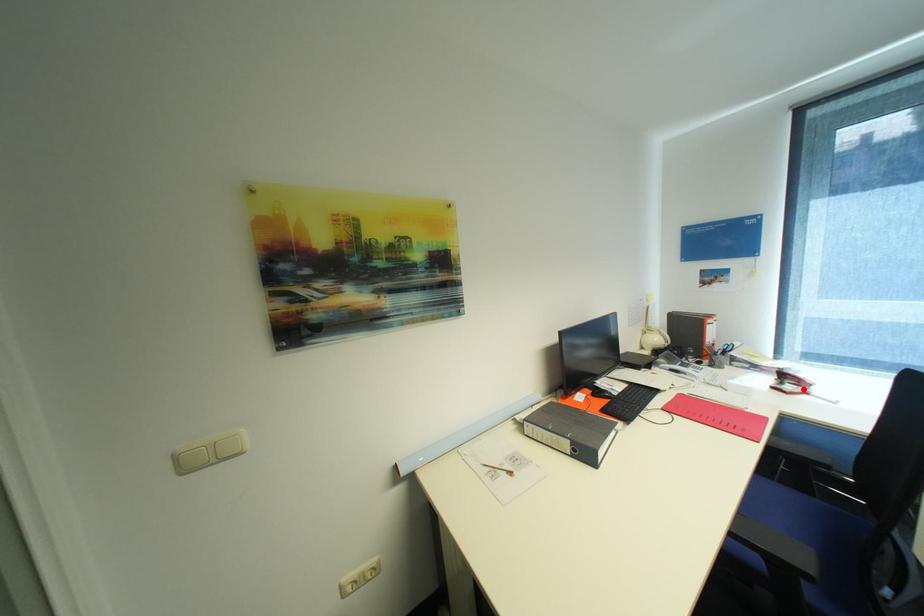
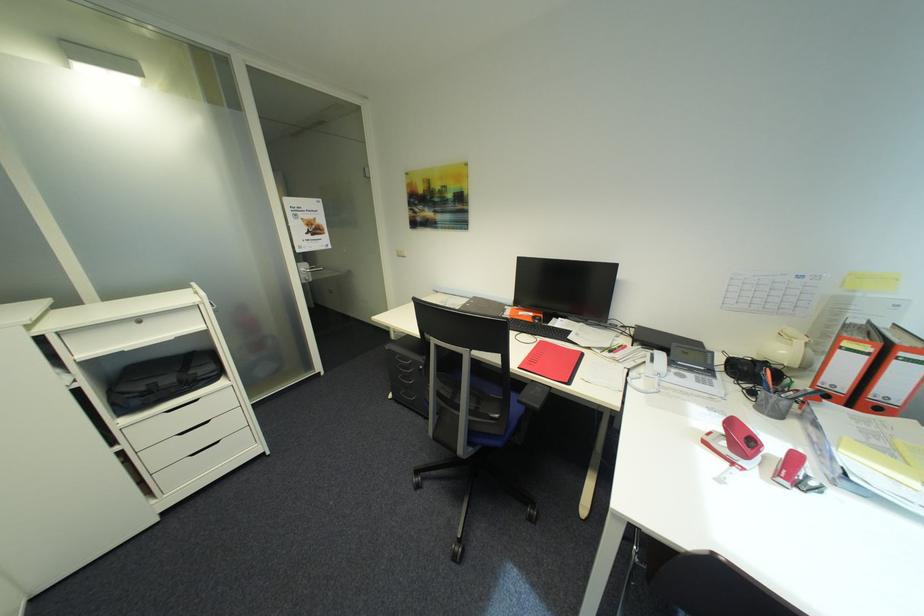
Find the pixel in the second image that matches the highlighted location in the first image.

(730, 447)